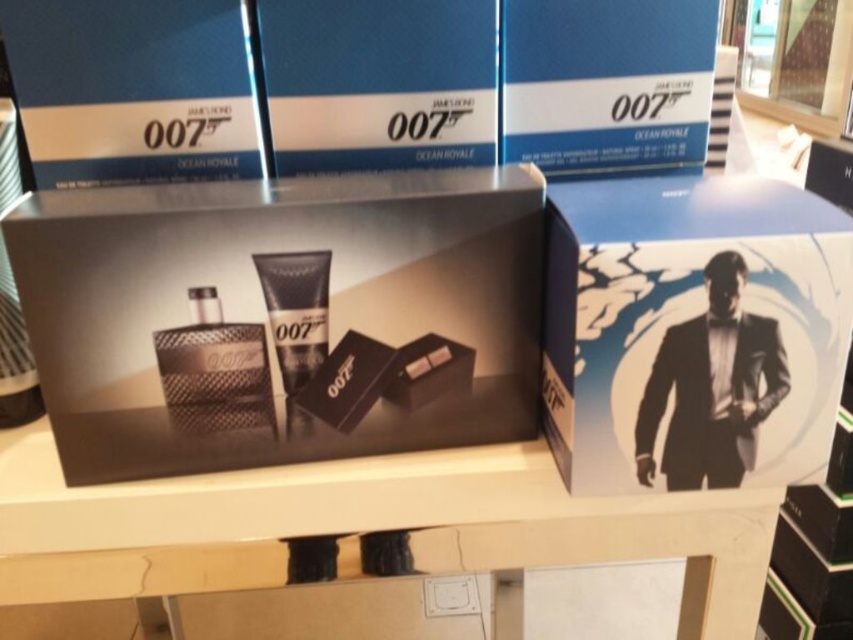
Question: Which of the following is the closest to the observer?

Choices:
 (A) 706,424
 (B) 281,582

Answer: (A)

Question: Estimate the real-world distances between objects in this image. Which object is closer to the blue cardboard box at upper left?

Choices:
 (A) matte black box at center
 (B) matte black tube at center
 (C) blue cardboard box at center
 (D) matte black suit at center

Answer: (C)

Question: Where is matte black box at center located in relation to matte black suit at center in the image?

Choices:
 (A) left
 (B) right

Answer: (A)

Question: Which object is the closest to the blue cardboard box at center?

Choices:
 (A) matte black tube at center
 (B) matte black suit at center
 (C) matte black box at center

Answer: (C)

Question: Does matte black box at center have a greater width compared to white glossy table at center?

Choices:
 (A) no
 (B) yes

Answer: (A)

Question: Does matte black box at center come in front of matte black suit at center?

Choices:
 (A) yes
 (B) no

Answer: (B)